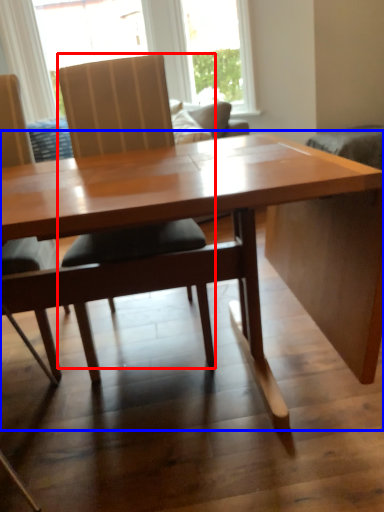
Question: Which object appears farthest to the camera in this image, chair (highlighted by a red box) or table (highlighted by a blue box)?

Choices:
 (A) chair
 (B) table

Answer: (A)